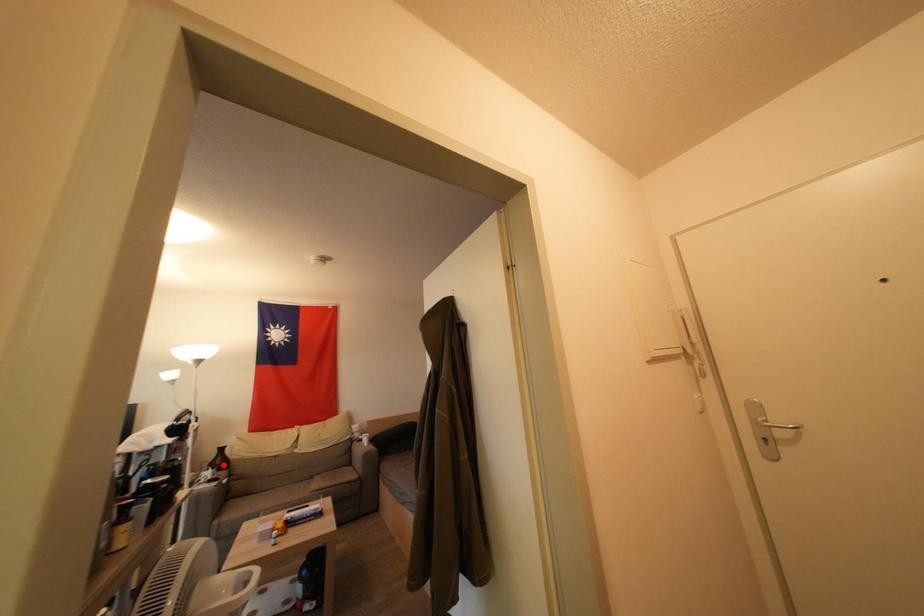
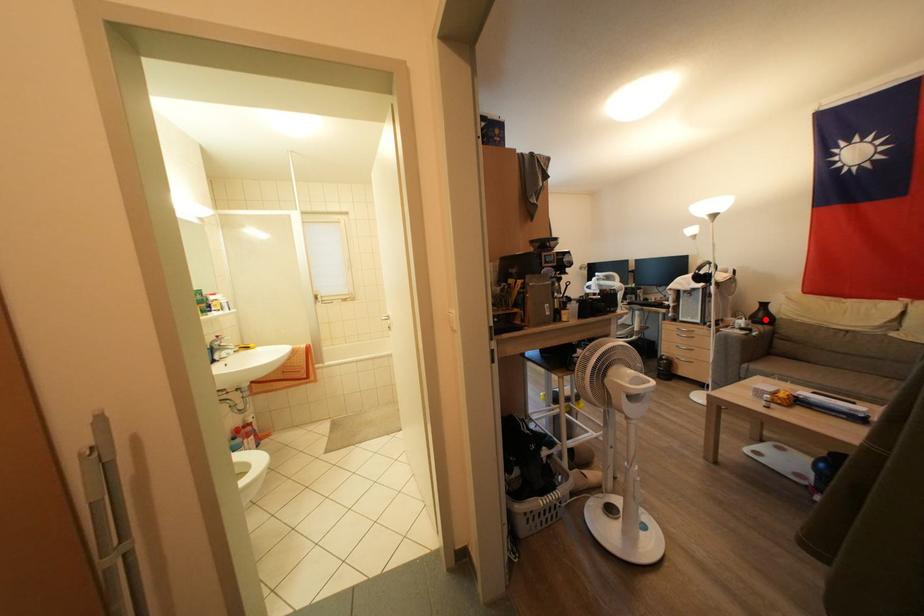
I am providing you with two images of the same scene from different viewpoints. A red point is marked on the first image and another point is marked on the second image. Does the point marked in image1 correspond to the same location as the one in image2?

Yes